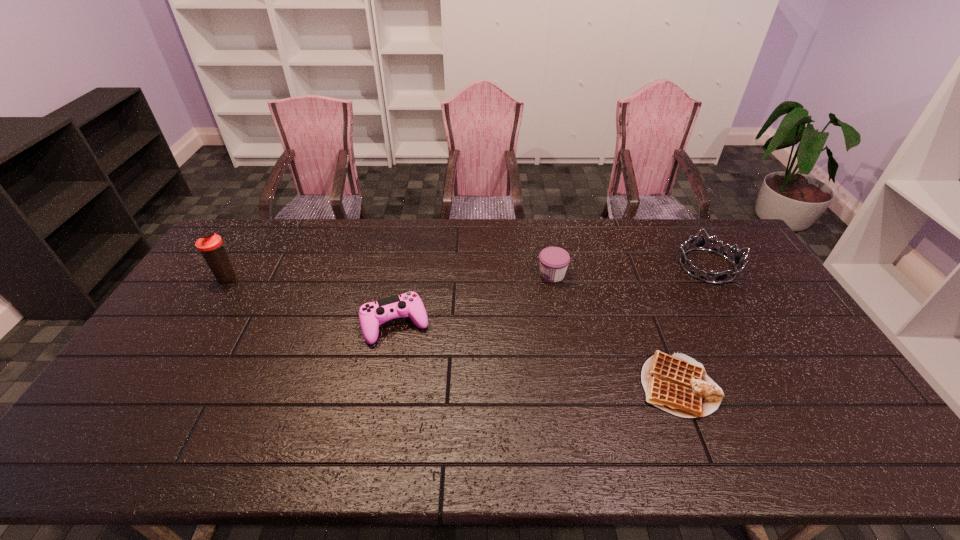
Find the location of a particular element. This screenshot has height=540, width=960. object present at the far right corner is located at coordinates (700, 244).

The height and width of the screenshot is (540, 960). In the image, there is a desktop. Find the location of `vacant region at the far edge`. vacant region at the far edge is located at coordinates (277, 227).

Find the location of a particular element. Image resolution: width=960 pixels, height=540 pixels. vacant space at the near edge of the desktop is located at coordinates (469, 444).

Identify the location of free spot at the left edge of the desktop. (223, 285).

The height and width of the screenshot is (540, 960). Identify the location of vacant space at the right edge of the desktop. (861, 421).

You are a GUI agent. You are given a task and a screenshot of the screen. Output one action in this format:
    pyautogui.click(x=<x>, y=<y>)
    Task: Click on the vacant area that lies between the leftmost object and the third object from left to right
    This screenshot has width=960, height=540.
    Given the screenshot: What is the action you would take?
    pyautogui.click(x=390, y=276)

Where is `empty space between the third object from left to right and the thermos bottle`? empty space between the third object from left to right and the thermos bottle is located at coordinates click(x=390, y=276).

Identify the location of empty space between the tallest object and the control. (312, 301).

Where is `free spot between the third object from left to right and the leftmost object`? This screenshot has width=960, height=540. free spot between the third object from left to right and the leftmost object is located at coordinates (390, 276).

The height and width of the screenshot is (540, 960). I want to click on free space between the rightmost object and the thermos bottle, so click(468, 272).